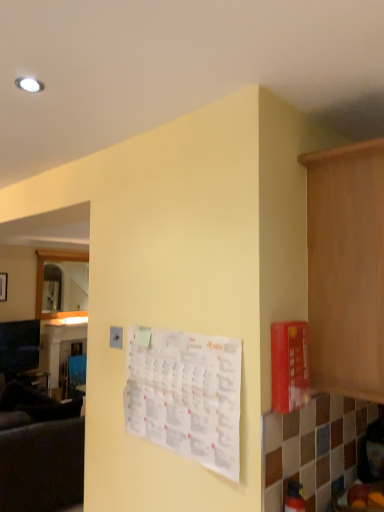
Where is `white paper calendar at center`? The width and height of the screenshot is (384, 512). white paper calendar at center is located at coordinates (186, 395).

The height and width of the screenshot is (512, 384). Find the location of `white paper calendar at center`. white paper calendar at center is located at coordinates (186, 395).

Which is behind, dark gray fabric couch at left or wooden cabinet at right?

dark gray fabric couch at left is more distant.

From a real-world perspective, between dark gray fabric couch at left and wooden cabinet at right, who is vertically lower?

dark gray fabric couch at left, from a real-world perspective.

Find the location of `cabinetry that appears on the right of dark gray fabric couch at left`. cabinetry that appears on the right of dark gray fabric couch at left is located at coordinates (346, 269).

Do you think dark gray fabric couch at left is within white paper calendar at center, or outside of it?

dark gray fabric couch at left is not enclosed by white paper calendar at center.

From the image's perspective, is dark gray fabric couch at left below white paper calendar at center?

Correct, dark gray fabric couch at left appears lower than white paper calendar at center in the image.

Is the depth of dark gray fabric couch at left less than that of white paper calendar at center?

No, dark gray fabric couch at left is further to the viewer.

Image resolution: width=384 pixels, height=512 pixels. In order to click on bulletin board on the right side of dark gray fabric couch at left in this screenshot , I will do `click(186, 395)`.

From the image's perspective, is white paper calendar at center below dark gray fabric couch at left?

Incorrect, from the image's perspective, white paper calendar at center is higher than dark gray fabric couch at left.

Between point (217, 349) and point (15, 424), which one is positioned in front?

Point (217, 349)

Is white paper calendar at center beside dark gray fabric couch at left?

→ They are not placed beside each other.

Image resolution: width=384 pixels, height=512 pixels. Find the location of `bulletin board that appears above the dark gray fabric couch at left (from the image's perspective)`. bulletin board that appears above the dark gray fabric couch at left (from the image's perspective) is located at coordinates (186, 395).

Looking at this image, is wooden cabinet at right at the right side of dark gray fabric couch at left?

Yes.

Who is bigger, wooden cabinet at right or dark gray fabric couch at left?

Bigger between the two is dark gray fabric couch at left.

Consider the image. Is wooden cabinet at right oriented towards dark gray fabric couch at left?

No, wooden cabinet at right is not facing towards dark gray fabric couch at left.

From a real-world perspective, is white paper calendar at center on wooden cabinet at right?

No.

Between point (236, 466) and point (335, 205), which one is positioned in front?

Positioned in front is point (236, 466).

Looking at this image, from the image's perspective, which is above, white paper calendar at center or wooden cabinet at right?

wooden cabinet at right, from the image's perspective.

Is white paper calendar at center positioned before wooden cabinet at right?

No, white paper calendar at center is behind wooden cabinet at right.

Relative to white paper calendar at center, is wooden cabinet at right in front or behind?

wooden cabinet at right is in front of white paper calendar at center.

Is point (368, 177) farther from viewer compared to point (181, 367)?

No, it is in front of (181, 367).

Consider the image. Considering the sizes of wooden cabinet at right and white paper calendar at center in the image, is wooden cabinet at right bigger or smaller than white paper calendar at center?

Clearly, wooden cabinet at right is larger in size than white paper calendar at center.

What are the coordinates of `couch behind the wooden cabinet at right` in the screenshot? It's located at 41,457.

This screenshot has width=384, height=512. I want to click on bulletin board in front of the dark gray fabric couch at left, so click(x=186, y=395).

Based on their spatial positions, is dark gray fabric couch at left or white paper calendar at center further from wooden cabinet at right?

dark gray fabric couch at left is further to wooden cabinet at right.

When comparing their distances from wooden cabinet at right, does white paper calendar at center or dark gray fabric couch at left seem closer?

→ Based on the image, white paper calendar at center appears to be nearer to wooden cabinet at right.

When comparing their distances from white paper calendar at center, does wooden cabinet at right or dark gray fabric couch at left seem closer?

wooden cabinet at right is closer to white paper calendar at center.

When comparing their distances from dark gray fabric couch at left, does white paper calendar at center or wooden cabinet at right seem closer?

white paper calendar at center is positioned closer to the anchor dark gray fabric couch at left.

Based on their spatial positions, is dark gray fabric couch at left or wooden cabinet at right further from white paper calendar at center?

Based on the image, dark gray fabric couch at left appears to be further to white paper calendar at center.

Based on their spatial positions, is wooden cabinet at right or white paper calendar at center closer to dark gray fabric couch at left?

white paper calendar at center lies closer to dark gray fabric couch at left than the other object.

The width and height of the screenshot is (384, 512). What are the coordinates of `bulletin board between dark gray fabric couch at left and wooden cabinet at right` in the screenshot? It's located at (186, 395).